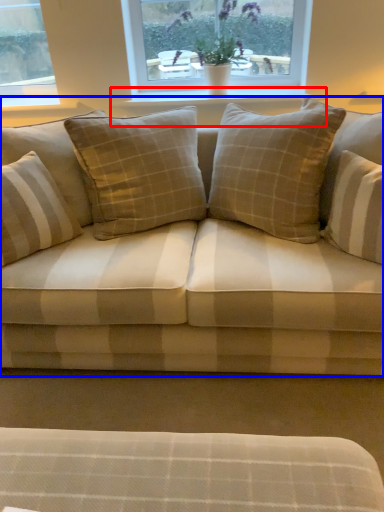
Question: Which object appears farthest to the camera in this image, window sill (highlighted by a red box) or studio couch (highlighted by a blue box)?

Choices:
 (A) window sill
 (B) studio couch

Answer: (A)